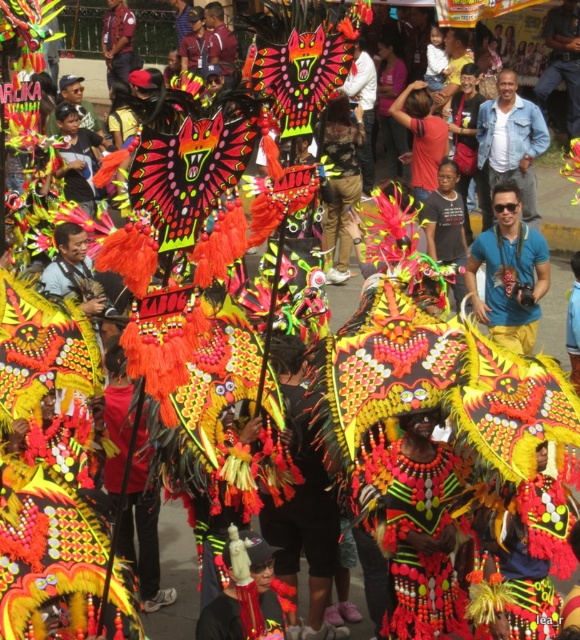
Question: Where is blue fabric shirt at center located in relation to blue fabric at center in the image?

Choices:
 (A) left
 (B) right

Answer: (A)

Question: Among these objects, which one is nearest to the camera?

Choices:
 (A) blue fabric at center
 (B) blue fabric shirt at center

Answer: (A)

Question: Does blue fabric shirt at center come in front of blue fabric at center?

Choices:
 (A) no
 (B) yes

Answer: (A)

Question: Is blue fabric shirt at center above blue fabric at center?

Choices:
 (A) yes
 (B) no

Answer: (A)

Question: Among these points, which one is nearest to the camera?

Choices:
 (A) (571, 364)
 (B) (491, 285)

Answer: (A)